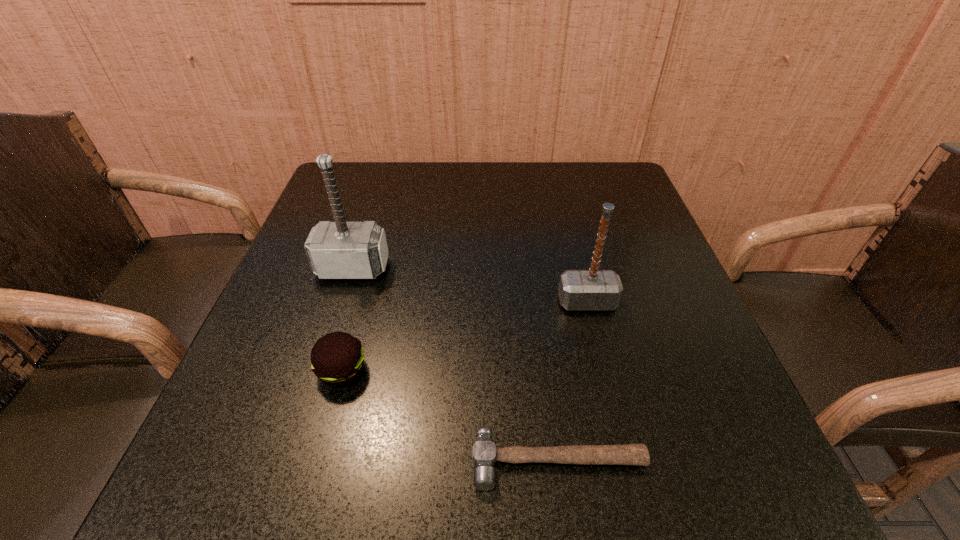
Identify the location of the farthest hammer. (336, 250).

Identify the location of the leftmost hammer. (336, 250).

Locate an element on the screen. the third shortest object is located at coordinates (593, 289).

At what (x,y) coordinates should I click in order to perform the action: click on the second shortest hammer. Please return your answer as a coordinate pair (x, y). This screenshot has height=540, width=960. Looking at the image, I should click on (593, 289).

You are a GUI agent. You are given a task and a screenshot of the screen. Output one action in this format:
    pyautogui.click(x=<x>, y=<y>)
    Task: Click on the second shortest object
    The width and height of the screenshot is (960, 540).
    Given the screenshot: What is the action you would take?
    pyautogui.click(x=337, y=358)

Identify the location of the second nearest object. Image resolution: width=960 pixels, height=540 pixels. (337, 358).

Locate an element on the screen. the nearest object is located at coordinates (484, 453).

Identify the location of the nearest hammer. (484, 453).

Locate an element on the screen. This screenshot has height=540, width=960. vacant position located for striking with the head of the farthest hammer is located at coordinates (290, 468).

Find the location of a particular element. vacant space positioned 0.280m on the striking surface of the second farthest hammer is located at coordinates (625, 457).